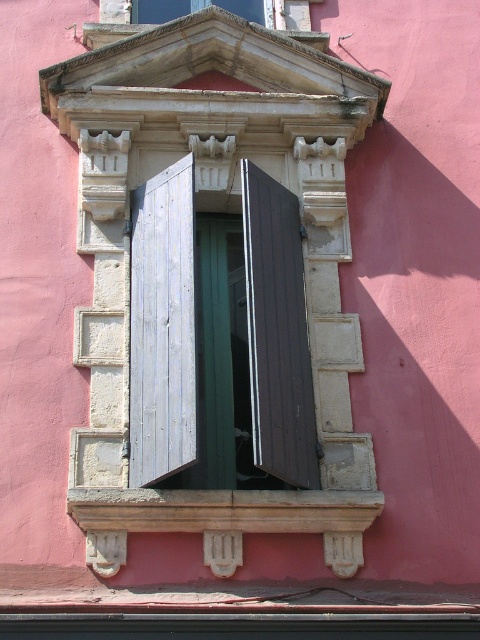
Question: Which is nearer to the brown wooden shutter at center?

Choices:
 (A) light gray wood shutter at left
 (B) wooden shutters at upper center

Answer: (A)

Question: Which of the following is the closest to the observer?

Choices:
 (A) (249, 273)
 (B) (141, 477)

Answer: (B)

Question: Does brown wooden shutter at center appear on the right side of wooden shutters at upper center?

Choices:
 (A) no
 (B) yes

Answer: (B)

Question: Which point is farther from the camera taking this photo?

Choices:
 (A) (182, 1)
 (B) (192, 161)

Answer: (A)

Question: Does light gray wood shutter at left have a lesser width compared to wooden shutters at upper center?

Choices:
 (A) yes
 (B) no

Answer: (B)

Question: Can you confirm if brown wooden shutter at center is wider than wooden shutters at upper center?

Choices:
 (A) yes
 (B) no

Answer: (A)